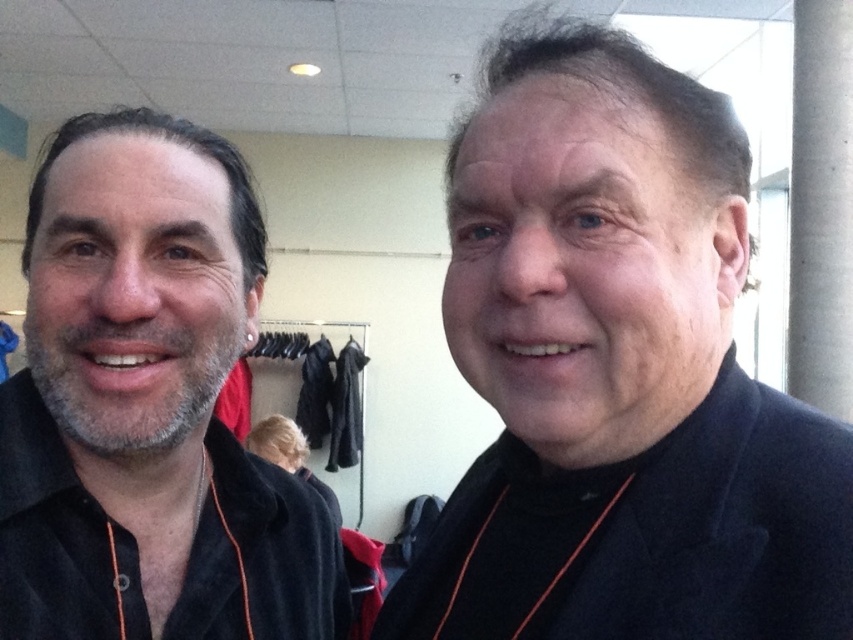
Does matte black shirt at left have a larger size compared to black woolen robe at right?

Correct, matte black shirt at left is larger in size than black woolen robe at right.

Is point (90, 396) positioned after point (601, 627)?

Yes, it is.

The image size is (853, 640). What are the coordinates of `matte black shirt at left` in the screenshot? It's located at (148, 406).

Which is in front, point (662, 125) or point (39, 554)?

Point (662, 125) is in front.

Does black matte jacket at right have a lesser height compared to matte black shirt at left?

No, black matte jacket at right is not shorter than matte black shirt at left.

What do you see at coordinates (618, 374) in the screenshot? The width and height of the screenshot is (853, 640). I see `black matte jacket at right` at bounding box center [618, 374].

Locate an element on the screen. Image resolution: width=853 pixels, height=640 pixels. black matte jacket at right is located at coordinates (618, 374).

What do you see at coordinates (618, 374) in the screenshot? The image size is (853, 640). I see `black matte jacket at right` at bounding box center [618, 374].

Does black matte jacket at right appear under black fabric robe at center?

No.

This screenshot has height=640, width=853. What are the coordinates of `black matte jacket at right` in the screenshot? It's located at (618, 374).